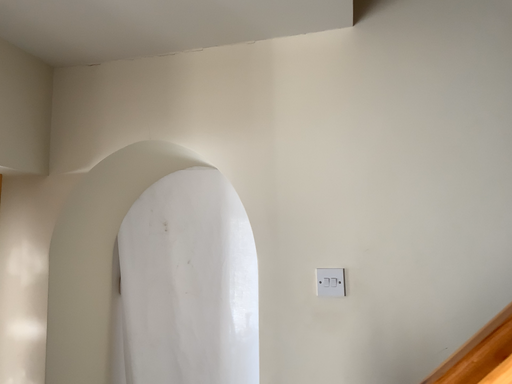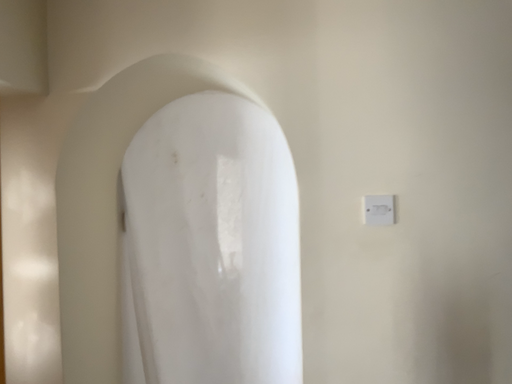
Question: Which way did the camera rotate in the video?

Choices:
 (A) rotated upward
 (B) rotated downward

Answer: (B)